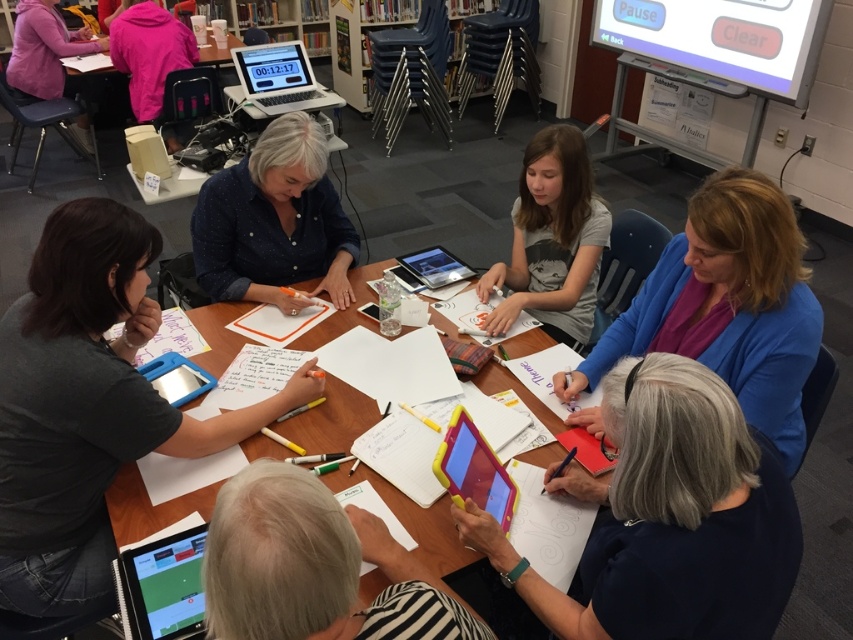
Based on the photo, is dark gray shirt at lower left closer to the viewer compared to matte pink hoodie at upper left?

Yes, dark gray shirt at lower left is closer to the viewer.

Can you confirm if dark gray shirt at lower left is positioned to the right of matte pink hoodie at upper left?

Indeed, dark gray shirt at lower left is positioned on the right side of matte pink hoodie at upper left.

Is point (93, 404) more distant than point (88, 81)?

No, it is not.

Where is `dark gray shirt at lower left`? dark gray shirt at lower left is located at coordinates (88, 404).

Based on the photo, is blue dotted shirt at center positioned before silver metallic laptop at upper left?

Yes, it is.

Between blue dotted shirt at center and silver metallic laptop at upper left, which one has more height?

blue dotted shirt at center is taller.

Identify the location of blue dotted shirt at center. (274, 221).

Where is `blue dotted shirt at center`? The image size is (853, 640). blue dotted shirt at center is located at coordinates (274, 221).

Measure the distance from silver metallic laptop at upper left to silver metallic laptop at center.

silver metallic laptop at upper left is 1.60 meters from silver metallic laptop at center.

Between silver metallic laptop at upper left and silver metallic laptop at center, which one has more height?

silver metallic laptop at upper left

Where is `silver metallic laptop at upper left`? This screenshot has width=853, height=640. silver metallic laptop at upper left is located at coordinates (277, 77).

At what (x,y) coordinates should I click in order to perform the action: click on silver metallic laptop at upper left. Please return your answer as a coordinate pair (x, y). Looking at the image, I should click on (277, 77).